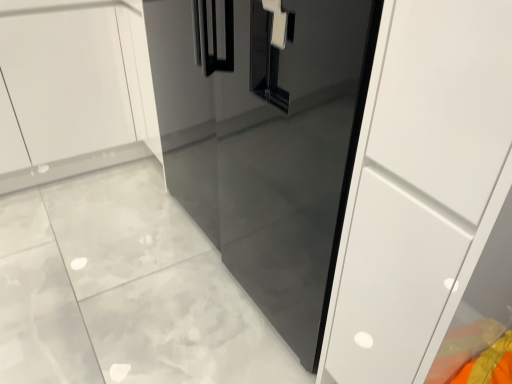
Question: Should I look upward or downward to see glossy black door at center?

Choices:
 (A) up
 (B) down

Answer: (A)